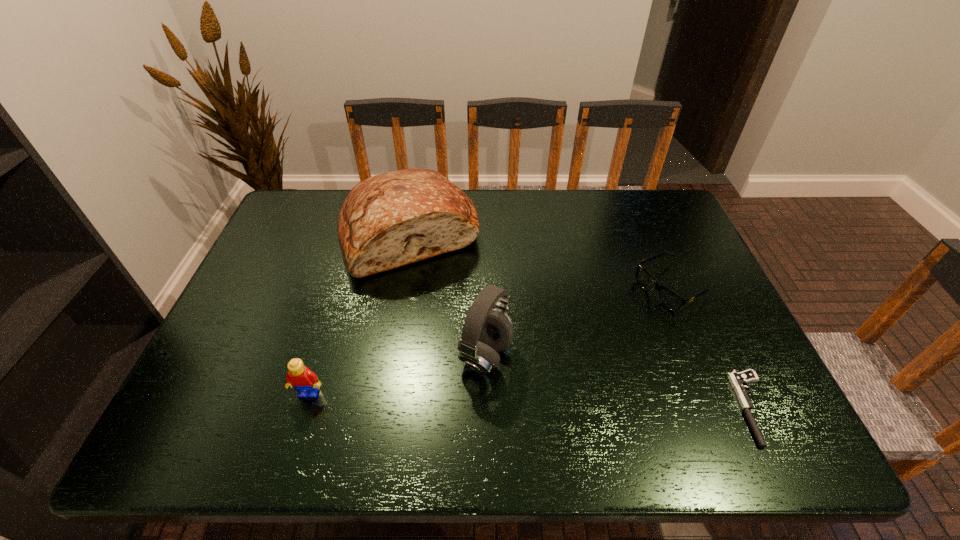
Identify the location of free area in between the Lego and the headset. (397, 374).

Where is `free space between the sunglasses and the headset`? free space between the sunglasses and the headset is located at coordinates (579, 321).

I want to click on vacant space in between the headset and the bread, so click(x=448, y=295).

Identify the location of free space between the Lego and the headset. (397, 374).

Where is `the second closest object to the sunglasses`? the second closest object to the sunglasses is located at coordinates (485, 332).

Locate an element on the screen. This screenshot has width=960, height=540. object that stands as the second closest to the bread is located at coordinates (299, 377).